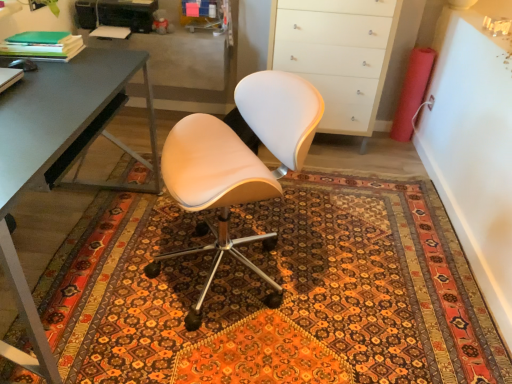
Question: From a real-world perspective, is patterned carpet at center on top of white glossy cabinet at upper right?

Choices:
 (A) no
 (B) yes

Answer: (A)

Question: Considering the relative sizes of patterned carpet at center and white glossy cabinet at upper right in the image provided, is patterned carpet at center bigger than white glossy cabinet at upper right?

Choices:
 (A) no
 (B) yes

Answer: (A)

Question: Would you say white glossy cabinet at upper right is part of patterned carpet at center's contents?

Choices:
 (A) yes
 (B) no

Answer: (B)

Question: Is patterned carpet at center at the right side of white glossy cabinet at upper right?

Choices:
 (A) no
 (B) yes

Answer: (A)

Question: Is patterned carpet at center positioned before white glossy cabinet at upper right?

Choices:
 (A) yes
 (B) no

Answer: (A)

Question: Is white glossy cabinet at upper right at the back of patterned carpet at center?

Choices:
 (A) no
 (B) yes

Answer: (A)

Question: From a real-world perspective, is green matte folder at upper left positioned over matte white chair at center based on gravity?

Choices:
 (A) yes
 (B) no

Answer: (A)

Question: Is green matte folder at upper left positioned behind matte white chair at center?

Choices:
 (A) yes
 (B) no

Answer: (A)

Question: Can we say green matte folder at upper left lies outside matte white chair at center?

Choices:
 (A) yes
 (B) no

Answer: (A)

Question: Can you confirm if green matte folder at upper left is smaller than matte white chair at center?

Choices:
 (A) yes
 (B) no

Answer: (A)

Question: Considering the relative positions of green matte folder at upper left and matte white chair at center in the image provided, is green matte folder at upper left to the right of matte white chair at center from the viewer's perspective?

Choices:
 (A) no
 (B) yes

Answer: (A)

Question: Can you confirm if green matte folder at upper left is taller than matte white chair at center?

Choices:
 (A) no
 (B) yes

Answer: (A)

Question: Does matte white chair at center have a lesser height compared to green matte folder at upper left?

Choices:
 (A) no
 (B) yes

Answer: (A)